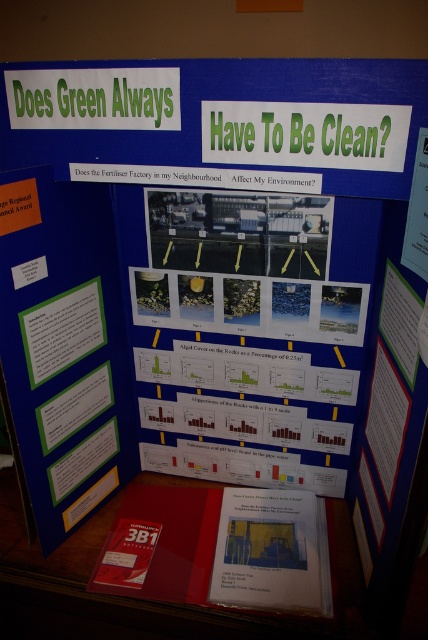
Which of these two, yellow paper at center or green paper at upper center, stands shorter?

green paper at upper center

Between point (282, 529) and point (12, 84), which one is positioned behind?

The point (282, 529) is more distant.

The image size is (428, 640). I want to click on yellow paper at center, so click(272, 552).